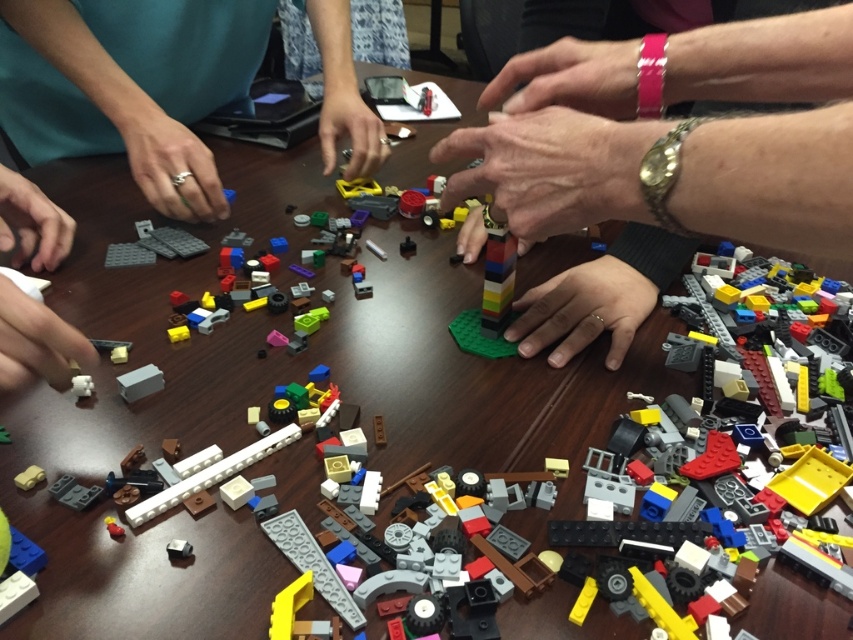
You are organizing a LEGO building event and need to ensure that all participants have enough space on the table. The table has a narrow strip of 5 cm width between the smooth metallic watch at center and the pink rubber band at upper center. Can the watch fit in this space without overlapping the rubber band?

The smooth metallic watch at center might be wider than the pink rubber band at upper center, so it may not fit in the 5 cm space without overlapping the pink rubber band at upper center.

You are observing a LEGO building session at the table. You notice the matte green shirt at upper left and the white matte cube at center. Which object is closer to you from your viewpoint?

The matte green shirt at upper left is closer to you because it is in front of the white matte cube at center, which is positioned behind it.

You are standing at the table where people are building LEGO sets. You notice two points marked on the table surface. The first point is at coordinate point (x=561, y=38) and the second point is at coordinate point (x=20, y=182). From your perspective, which point is closer to you?

Point (x=561, y=38) is in front of point (x=20, y=182), so it is closer to you.